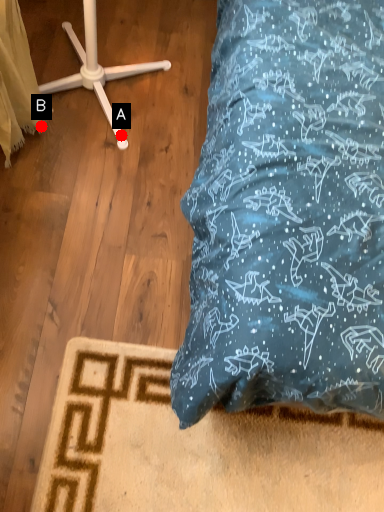
Question: Two points are circled on the image, labeled by A and B beside each circle. Among these points, which one is nearest to the camera?

Choices:
 (A) A is closer
 (B) B is closer

Answer: (B)